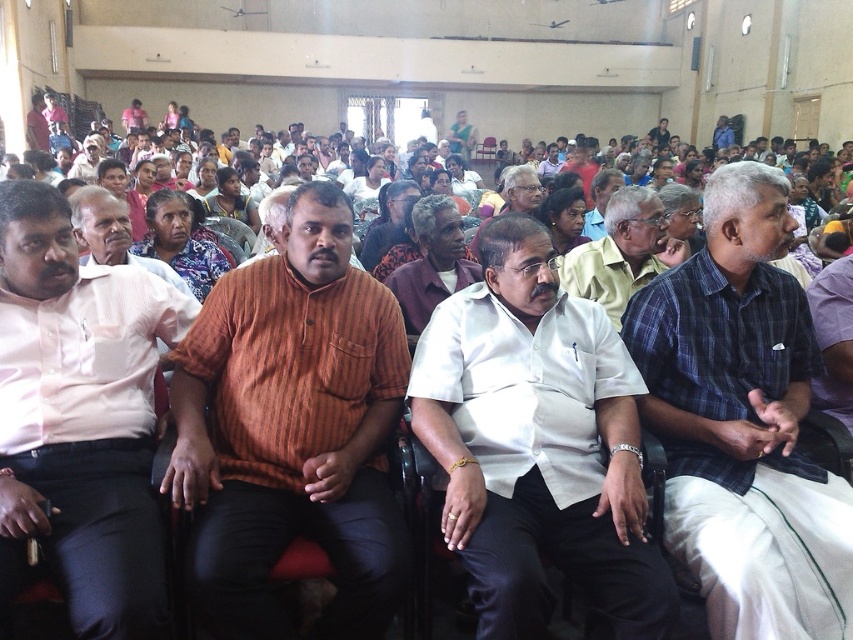
From the picture: Who is more distant from viewer, (795,396) or (567,224)?

Point (567,224)

Can you confirm if blue plaid shirt at center is thinner than matte brown shirt at center?

In fact, blue plaid shirt at center might be wider than matte brown shirt at center.

Which is in front, point (743, 237) or point (556, 202)?

Point (743, 237)

This screenshot has height=640, width=853. I want to click on blue plaid shirt at center, so click(743, 420).

Does dark brown striped shirt at center have a greater width compared to matte orange shirt at center?

Incorrect, dark brown striped shirt at center's width does not surpass matte orange shirt at center's.

Is dark brown striped shirt at center to the left of matte orange shirt at center from the viewer's perspective?

In fact, dark brown striped shirt at center is to the right of matte orange shirt at center.

Between point (376, 248) and point (236, 195), which one is positioned in front?

Positioned in front is point (376, 248).

The image size is (853, 640). Find the location of `dark brown striped shirt at center`. dark brown striped shirt at center is located at coordinates (389, 221).

Does white shirt at center appear on the right side of dark brown striped shirt at center?

Yes, white shirt at center is to the right of dark brown striped shirt at center.

At what (x,y) coordinates should I click in order to perform the action: click on white shirt at center. Please return your answer as a coordinate pair (x, y). The image size is (853, 640). Looking at the image, I should click on (621, 252).